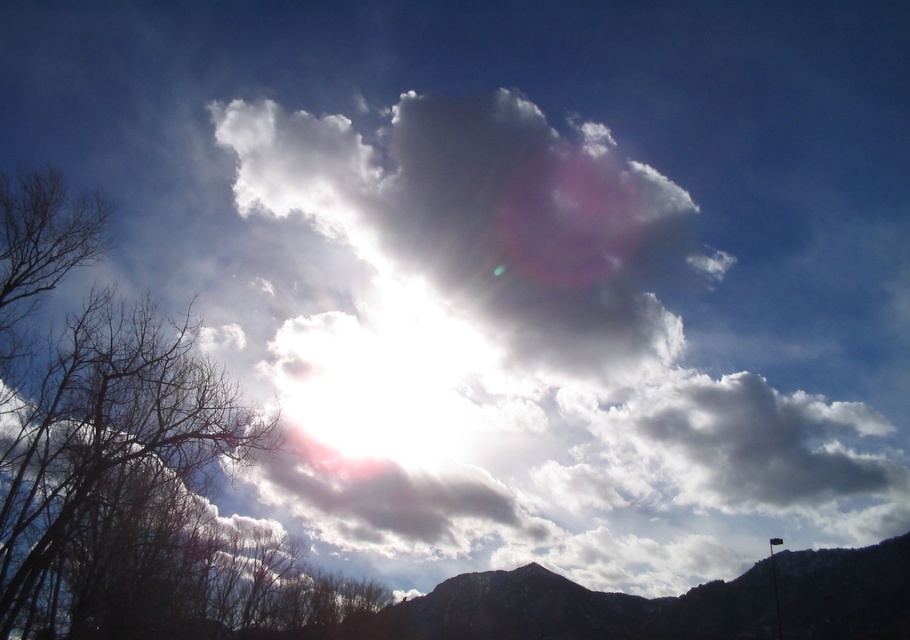
You are an outdoor photographer planning to capture this scene. You want to ensure that both the bare branches at left and the dark gray rocky mountain at lower center are clearly visible in your shot. Based on their positions, which object should you focus on first to ensure both are in focus?

Since the bare branches at left is located above the dark gray rocky mountain at lower center, you should focus on the bare branches at left first. This way, the depth of field will naturally cover the mountain below, keeping both in focus.

You are an artist sketching this scene. You want to ensure the bare branches at left and dark gray rocky mountain at lower center are proportionate. Which one should you draw taller?

The bare branches at left should be drawn taller than the dark gray rocky mountain at lower center because the description states that the bare branches at left has a greater height compared to dark gray rocky mountain at lower center.

Consider the image. You are a photographer trying to capture the mountain in the background. However, there are bare branches at left blocking your view. Can you adjust your position to avoid the branches while still keeping the dark gray rocky mountain at lower center in the frame?

The bare branches at left are in front of the dark gray rocky mountain at lower center, so moving the camera position to the right or left might allow you to reposition the branches so they no longer block the mountain while keeping the mountain in the frame.